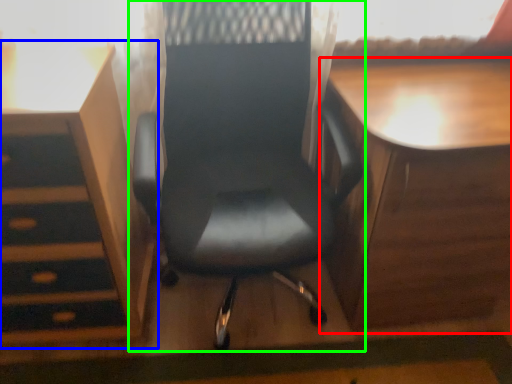
Question: Which object is the farthest from table (highlighted by a red box)? Choose among these: vanity (highlighted by a blue box) or chair (highlighted by a green box).

Choices:
 (A) vanity
 (B) chair

Answer: (A)